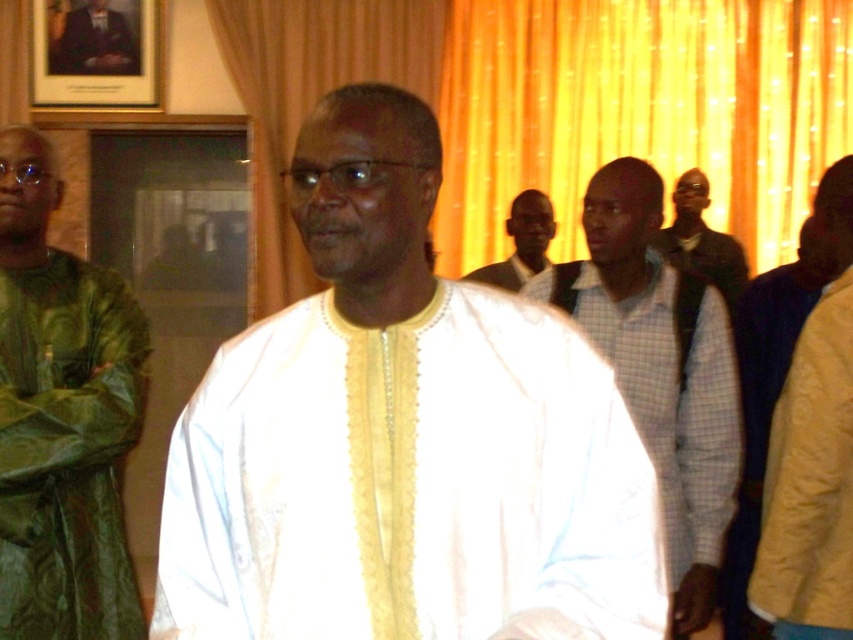
You are standing in the room and want to place a small vase on the white textured cloth at center. Can you estimate where exactly on the cloth the vase will be placed?

The white textured cloth at center is positioned at coordinates point (402, 436), so placing the vase there would be at that specific point.

You are standing in the room and want to move from the green satin shirt at left to the orange fabric curtain at upper center. Which direction should you move to reach it?

To reach the orange fabric curtain at upper center from the green satin shirt at left, you should move to the right since the orange fabric curtain at upper center is located to the right of the green satin shirt at left.